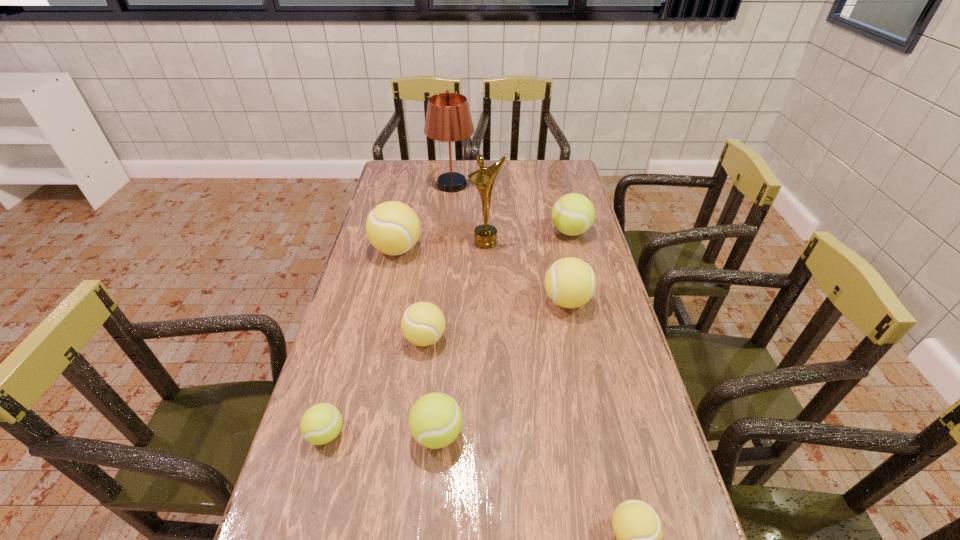
What are the coordinates of `lampshade` in the screenshot? It's located at (448, 118).

At what (x,y) coordinates should I click in order to perform the action: click on award. Please return your answer as a coordinate pair (x, y). The width and height of the screenshot is (960, 540). Looking at the image, I should click on (485, 236).

Identify the location of the tallest tennis ball. (393, 228).

You are a GUI agent. You are given a task and a screenshot of the screen. Output one action in this format:
    pyautogui.click(x=<x>, y=<y>)
    Task: Click on the biggest yellow tennis ball
    
    Given the screenshot: What is the action you would take?
    pyautogui.click(x=393, y=228)

Locate an element on the screen. This screenshot has height=540, width=960. the farthest green tennis ball is located at coordinates (573, 214).

Where is `the rightmost green tennis ball`? The width and height of the screenshot is (960, 540). the rightmost green tennis ball is located at coordinates (573, 214).

Locate an element on the screen. Image resolution: width=960 pixels, height=540 pixels. the fifth nearest object is located at coordinates (570, 282).

Where is `the second biggest yellow tennis ball`? The image size is (960, 540). the second biggest yellow tennis ball is located at coordinates tap(570, 282).

Locate an element on the screen. The height and width of the screenshot is (540, 960). the sixth farthest object is located at coordinates (423, 323).

This screenshot has width=960, height=540. I want to click on the third biggest yellow tennis ball, so click(423, 323).